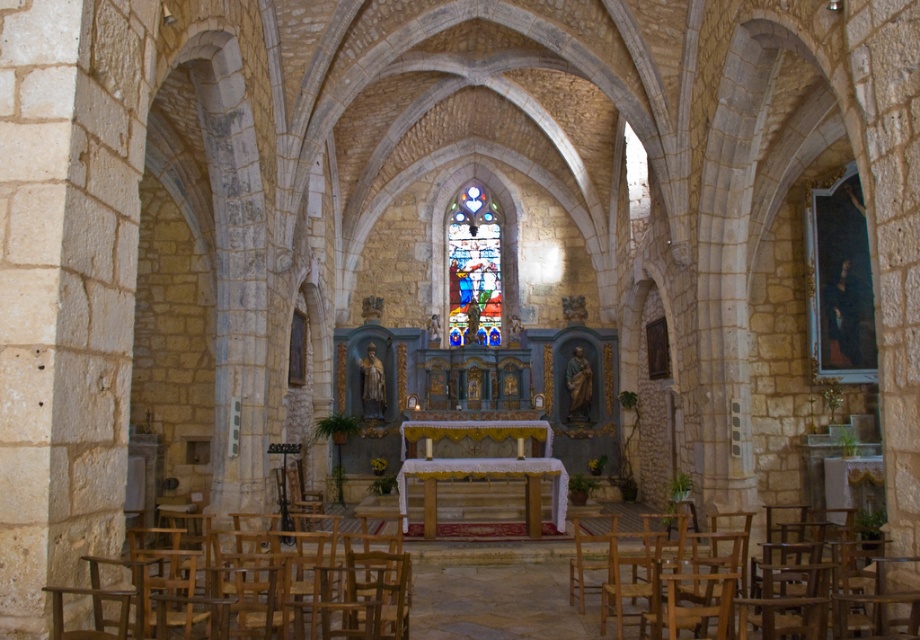
You are an interior designer planning to place a new rectangular rug in the church. The rug must be placed between the stained glass window at center and the light brown wood chair at lower center. Given their widths, which object should the rug be sized to accommodate in terms of width?

The stained glass window at center has a lesser width compared to light brown wood chair at lower center, so the rug should be sized to accommodate the width of the light brown wood chair at lower center to ensure it fits properly between them.

You are standing at the entrance of the church and want to sit down. There is a wooden chair at lower left. Can you reach it without crossing any obstacles?

The wooden chair at lower left is located at point (311, 595), so yes, you can reach it without crossing any obstacles as there are no other objects mentioned in the scene that would block your path.

Consider the image. You are standing in the church and want to determine which object is taller between the stained glass window at center and the light brown wood chair at lower center. Based on the scene, which one is taller?

The stained glass window at center has a greater height compared to the light brown wood chair at lower center, so the stained glass window at center is taller.